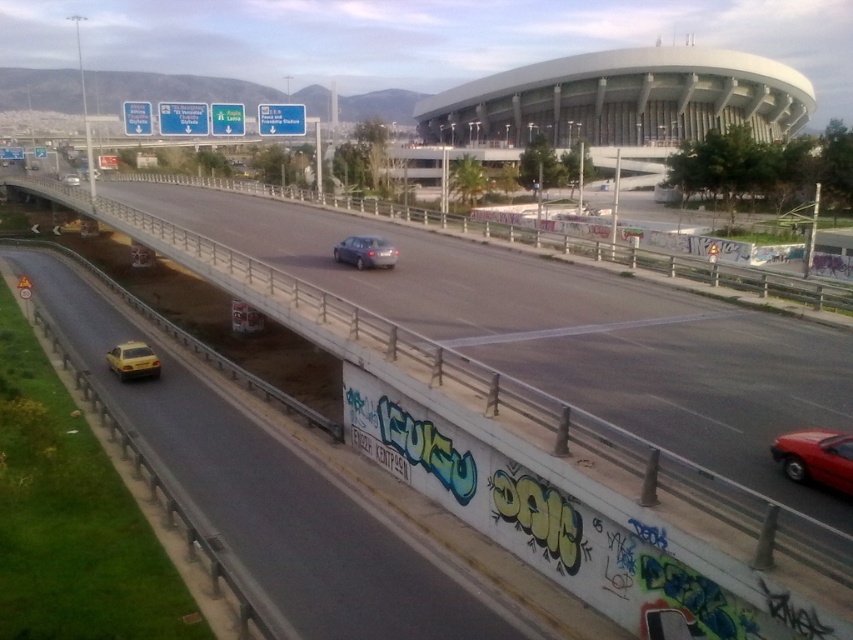
Which is in front, point (804, 467) or point (381, 252)?

Point (804, 467) is more forward.

Which is behind, point (842, 481) or point (395, 250)?

The point (395, 250) is behind.

You are a GUI agent. You are given a task and a screenshot of the screen. Output one action in this format:
    pyautogui.click(x=<x>, y=<y>)
    Task: Click on the shiny red sedan at lower right
    The image size is (853, 640).
    Given the screenshot: What is the action you would take?
    pyautogui.click(x=816, y=458)

Is concrete highway at center smaller than yellow matte taxi at center?

No, concrete highway at center is not smaller than yellow matte taxi at center.

Describe the element at coordinates (540, 442) in the screenshot. This screenshot has width=853, height=640. I see `concrete highway at center` at that location.

The height and width of the screenshot is (640, 853). In order to click on concrete highway at center in this screenshot , I will do `click(540, 442)`.

How far apart are shiny red sedan at lower right and yellow matte taxi at center?

97.21 meters

Does shiny red sedan at lower right appear on the right side of yellow matte taxi at center?

Correct, you'll find shiny red sedan at lower right to the right of yellow matte taxi at center.

Image resolution: width=853 pixels, height=640 pixels. I want to click on shiny red sedan at lower right, so click(x=816, y=458).